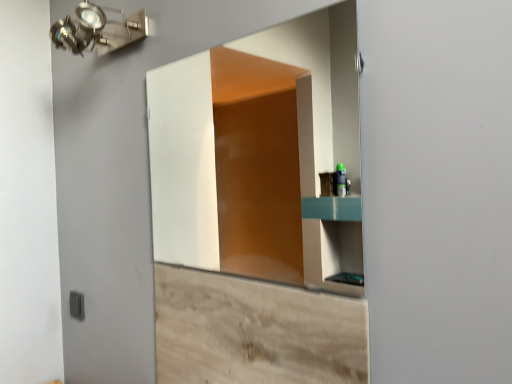
Question: Is matte glass mirror at center taller than wooden cabinet at lower center?

Choices:
 (A) yes
 (B) no

Answer: (A)

Question: Does matte glass mirror at center have a greater width compared to wooden cabinet at lower center?

Choices:
 (A) no
 (B) yes

Answer: (B)

Question: From the image's perspective, would you say matte glass mirror at center is positioned over wooden cabinet at lower center?

Choices:
 (A) no
 (B) yes

Answer: (B)

Question: Is matte glass mirror at center positioned beyond the bounds of wooden cabinet at lower center?

Choices:
 (A) yes
 (B) no

Answer: (A)

Question: Is matte glass mirror at center at the left side of wooden cabinet at lower center?

Choices:
 (A) no
 (B) yes

Answer: (B)

Question: Considering the positions of metallic wall-mounted light fixture at upper left and matte glass mirror at center in the image, is metallic wall-mounted light fixture at upper left taller or shorter than matte glass mirror at center?

Choices:
 (A) short
 (B) tall

Answer: (A)

Question: In the image, is metallic wall-mounted light fixture at upper left positioned in front of or behind matte glass mirror at center?

Choices:
 (A) behind
 (B) front

Answer: (A)

Question: Considering the positions of point (53, 41) and point (329, 139), is point (53, 41) closer or farther from the camera than point (329, 139)?

Choices:
 (A) closer
 (B) farther

Answer: (A)

Question: Visually, is metallic wall-mounted light fixture at upper left positioned to the left or to the right of matte glass mirror at center?

Choices:
 (A) left
 (B) right

Answer: (A)

Question: Considering their positions, is matte glass mirror at center located in front of or behind gray plastic light switch at lower left?

Choices:
 (A) front
 (B) behind

Answer: (A)

Question: Is point (200, 79) closer or farther from the camera than point (77, 312)?

Choices:
 (A) farther
 (B) closer

Answer: (A)

Question: From a real-world perspective, is matte glass mirror at center above or below gray plastic light switch at lower left?

Choices:
 (A) above
 (B) below

Answer: (A)

Question: From the image's perspective, relative to gray plastic light switch at lower left, is matte glass mirror at center above or below?

Choices:
 (A) above
 (B) below

Answer: (A)

Question: Considering the positions of gray plastic light switch at lower left and matte glass mirror at center in the image, is gray plastic light switch at lower left bigger or smaller than matte glass mirror at center?

Choices:
 (A) small
 (B) big

Answer: (A)

Question: Is gray plastic light switch at lower left taller or shorter than matte glass mirror at center?

Choices:
 (A) short
 (B) tall

Answer: (A)